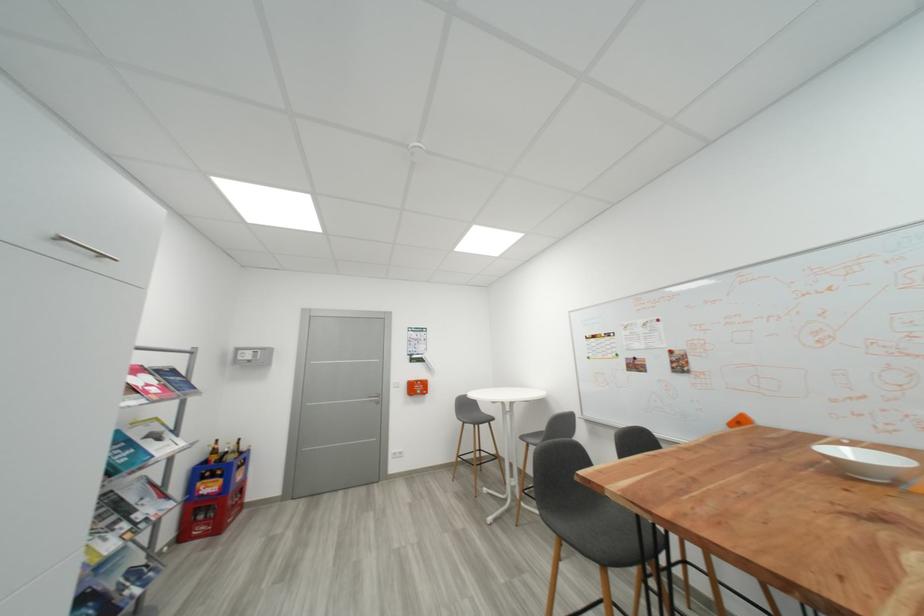
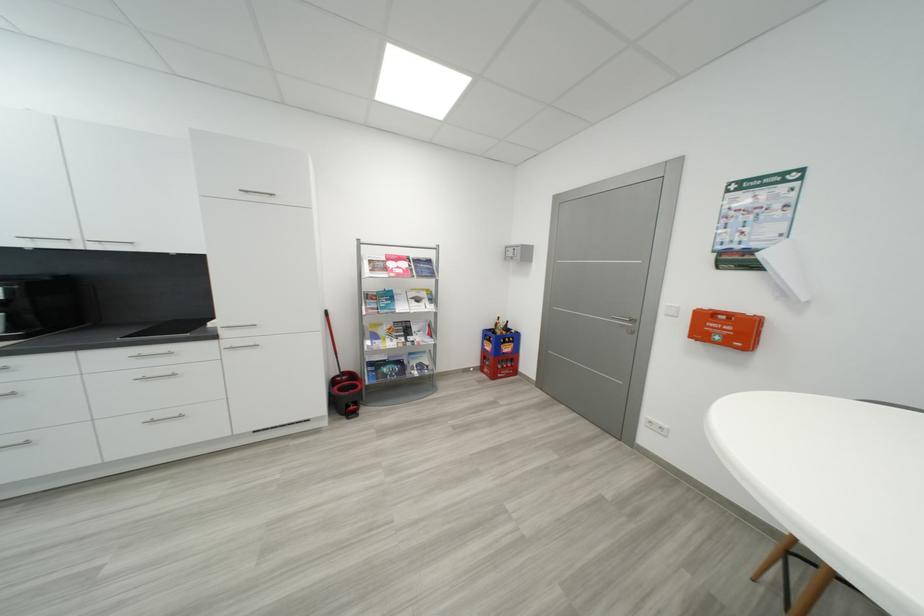
Locate, in the second image, the point that corresponds to pixel 424 390 in the first image.

(733, 333)